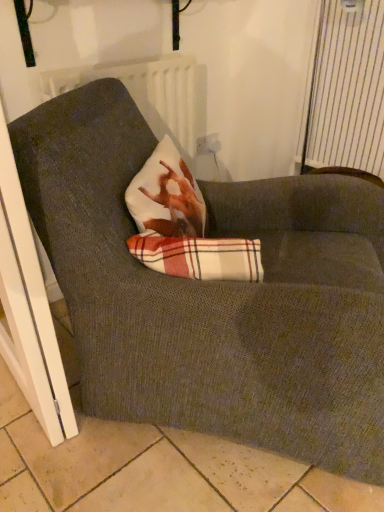
Describe the element at coordinates (199, 257) in the screenshot. This screenshot has height=512, width=384. I see `plaid fabric at center` at that location.

This screenshot has height=512, width=384. In order to click on white plastic screen door at lower left in this screenshot , I will do `click(29, 309)`.

Where is `white striped curtain at upper right`? Image resolution: width=384 pixels, height=512 pixels. white striped curtain at upper right is located at coordinates (347, 90).

Where is `plaid fabric at center`? plaid fabric at center is located at coordinates (199, 257).

Which of these two, white plastic screen door at lower left or plaid fabric at center, stands taller?

With more height is white plastic screen door at lower left.

Looking at this image, is white plastic screen door at lower left further to the viewer compared to plaid fabric at center?

No, white plastic screen door at lower left is in front of plaid fabric at center.

Would you say white plastic screen door at lower left is outside plaid fabric at center?

Yes, white plastic screen door at lower left is not within plaid fabric at center.

Identify the location of plaid below the white plastic screen door at lower left (from the image's perspective). (199, 257).

Is white plastic electric outlet at upper center in contact with plaid fabric at center?

They are not placed beside each other.

Which object is positioned more to the left, white plastic electric outlet at upper center or plaid fabric at center?

From the viewer's perspective, plaid fabric at center appears more on the left side.

Can plaid fabric at center be found inside white plastic electric outlet at upper center?

That's incorrect, plaid fabric at center is not inside white plastic electric outlet at upper center.

Is white plastic electric outlet at upper center aimed at plaid fabric at center?

No, white plastic electric outlet at upper center is not turned towards plaid fabric at center.

Which is less distant, (218, 138) or (362, 32)?

The point (362, 32) is in front.

From the image's perspective, is white plastic electric outlet at upper center above or below white striped curtain at upper right?

Based on their image positions, white plastic electric outlet at upper center is located beneath white striped curtain at upper right.

Would you say white plastic electric outlet at upper center is a long distance from white striped curtain at upper right?

No, white plastic electric outlet at upper center is in close proximity to white striped curtain at upper right.

Is white striped curtain at upper right surrounded by white plastic electric outlet at upper center?

No, white striped curtain at upper right is not surrounded by white plastic electric outlet at upper center.

Does plaid fabric at center have a lesser height compared to white striped curtain at upper right?

Indeed, plaid fabric at center has a lesser height compared to white striped curtain at upper right.

Is plaid fabric at center completely or partially outside of white striped curtain at upper right?

plaid fabric at center is positioned outside white striped curtain at upper right.

In the scene shown: Which of these two, plaid fabric at center or white striped curtain at upper right, is wider?

white striped curtain at upper right.

Which object is closer to the camera taking this photo, white plastic screen door at lower left or white striped curtain at upper right?

white plastic screen door at lower left is closer to the camera.

Which is closer, (8, 142) or (345, 71)?

The point (8, 142) is more forward.

Considering the relative positions of white plastic screen door at lower left and white striped curtain at upper right in the image provided, is white plastic screen door at lower left to the left of white striped curtain at upper right from the viewer's perspective?

Correct, you'll find white plastic screen door at lower left to the left of white striped curtain at upper right.

Is white plastic screen door at lower left far from white striped curtain at upper right?

That's right, there is a large distance between white plastic screen door at lower left and white striped curtain at upper right.

Can you tell me how much plaid fabric at center and white plastic screen door at lower left differ in facing direction?

The facing directions of plaid fabric at center and white plastic screen door at lower left are 139 degrees apart.

From the image's perspective, is plaid fabric at center above or below white plastic screen door at lower left?

From the image's perspective, plaid fabric at center appears below white plastic screen door at lower left.

Measure the distance from plaid fabric at center to white plastic screen door at lower left.

15.10 inches.

Considering the sizes of plaid fabric at center and white plastic screen door at lower left in the image, is plaid fabric at center bigger or smaller than white plastic screen door at lower left?

In the image, plaid fabric at center appears to be smaller than white plastic screen door at lower left.

Could you tell me if white plastic electric outlet at upper center is facing white plastic screen door at lower left?

No, white plastic electric outlet at upper center is not aimed at white plastic screen door at lower left.

Considering the relative positions of white plastic electric outlet at upper center and white plastic screen door at lower left in the image provided, is white plastic electric outlet at upper center to the right of white plastic screen door at lower left from the viewer's perspective?

Yes, white plastic electric outlet at upper center is to the right of white plastic screen door at lower left.

Measure the distance from white plastic electric outlet at upper center to white plastic screen door at lower left.

white plastic electric outlet at upper center and white plastic screen door at lower left are 1.18 meters apart from each other.

Looking at this image, from the image's perspective, which one is positioned higher, white plastic electric outlet at upper center or white plastic screen door at lower left?

white plastic electric outlet at upper center is shown above in the image.

Locate an element on the screen. The image size is (384, 512). screen door located above the plaid fabric at center (from a real-world perspective) is located at coordinates (29, 309).

Where is `plaid below the white plastic electric outlet at upper center (from the image's perspective)`? plaid below the white plastic electric outlet at upper center (from the image's perspective) is located at coordinates (199, 257).

Estimate the real-world distances between objects in this image. Which object is further from white striped curtain at upper right, white plastic electric outlet at upper center or plaid fabric at center?

plaid fabric at center is further to white striped curtain at upper right.

Based on their spatial positions, is white plastic screen door at lower left or white plastic electric outlet at upper center closer to plaid fabric at center?

white plastic screen door at lower left lies closer to plaid fabric at center than the other object.

Which object lies nearer to the anchor point white plastic electric outlet at upper center, white striped curtain at upper right or white plastic screen door at lower left?

white striped curtain at upper right is positioned closer to the anchor white plastic electric outlet at upper center.

Estimate the real-world distances between objects in this image. Which object is closer to white striped curtain at upper right, white plastic screen door at lower left or white plastic electric outlet at upper center?

white plastic electric outlet at upper center.

Considering their positions, is plaid fabric at center positioned further to white plastic electric outlet at upper center than white plastic screen door at lower left?

white plastic screen door at lower left is further to white plastic electric outlet at upper center.

Looking at this image, based on their spatial positions, is white striped curtain at upper right or plaid fabric at center further from white plastic electric outlet at upper center?

plaid fabric at center lies further to white plastic electric outlet at upper center than the other object.

Based on their spatial positions, is plaid fabric at center or white plastic electric outlet at upper center closer to white plastic screen door at lower left?

Among the two, plaid fabric at center is located nearer to white plastic screen door at lower left.

Looking at this image, based on their spatial positions, is white plastic electric outlet at upper center or white striped curtain at upper right further from white plastic screen door at lower left?

The object further to white plastic screen door at lower left is white striped curtain at upper right.

This screenshot has width=384, height=512. Find the location of `curtain between plaid fabric at center and white plastic electric outlet at upper center along the z-axis`. curtain between plaid fabric at center and white plastic electric outlet at upper center along the z-axis is located at coordinates (347, 90).

Where is `curtain located between white plastic screen door at lower left and white plastic electric outlet at upper center in the depth direction`? curtain located between white plastic screen door at lower left and white plastic electric outlet at upper center in the depth direction is located at coordinates (347, 90).

The image size is (384, 512). Identify the location of plaid between white plastic screen door at lower left and white plastic electric outlet at upper center along the z-axis. (199, 257).

At what (x,y) coordinates should I click in order to perform the action: click on plaid between white plastic screen door at lower left and white striped curtain at upper right in the horizontal direction. Please return your answer as a coordinate pair (x, y). Looking at the image, I should click on (199, 257).